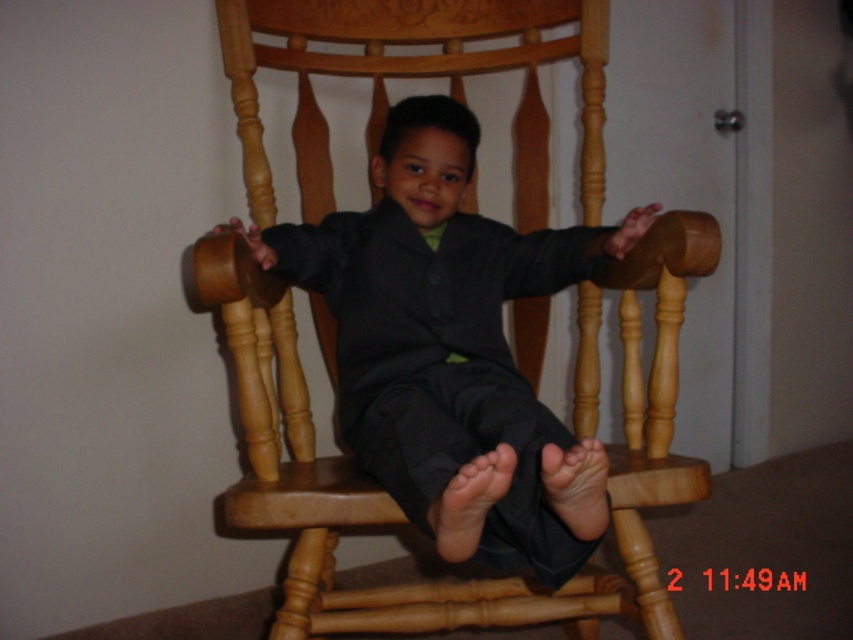
You are a fashion designer analyzing the image. The matte black suit at center is part of a collection that requires precise measurements. Can you determine if the suit is positioned centrally in the image based on its coordinates?

The coordinates of the matte black suit at center are exactly at the center point of the image, so yes, it is positioned centrally.

You are a photographer trying to capture a closeup of the matte black suit at center. Your camera has a minimum focusing distance of 1 meter. Can you take the photo without moving closer?

The distance between the matte black suit at center and the camera is 95.25 centimeters, which is less than 1 meter. Therefore, the camera cannot focus on the matte black suit at center as it is too close.

You are a photographer setting up a shoot with a young child in a formal outfit. You need to position your camera to capture both the barefoot at center and smooth skin foot at center clearly. Which foot should you focus on first to ensure it is in sharp focus?

The barefoot at center is closer to the viewer than the smooth skin foot at center, so you should focus on the barefoot at center first to ensure it is in sharp focus.